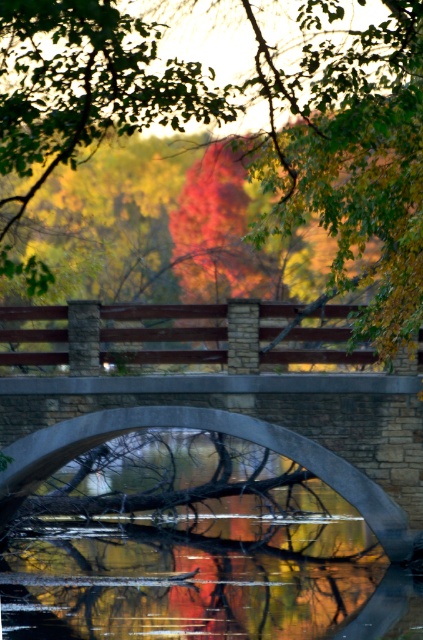
Question: Can you confirm if reddish-brown wood bridge at center is positioned to the left of stone bridge at center?

Choices:
 (A) no
 (B) yes

Answer: (A)

Question: Is reddish-brown wood bridge at center wider than stone bridge at center?

Choices:
 (A) no
 (B) yes

Answer: (A)

Question: Is reddish-brown wood bridge at center wider than stone bridge at center?

Choices:
 (A) yes
 (B) no

Answer: (B)

Question: Which object appears farthest from the camera in this image?

Choices:
 (A) stone bridge at center
 (B) reddish-brown wood bridge at center

Answer: (A)